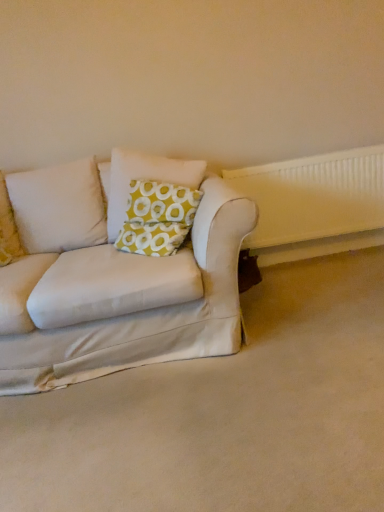
Question: Does white plastic radiator at right lie in front of white fabric couch at lower left?

Choices:
 (A) yes
 (B) no

Answer: (B)

Question: From a real-world perspective, is white plastic radiator at right under white fabric couch at lower left?

Choices:
 (A) yes
 (B) no

Answer: (B)

Question: From a real-world perspective, is white plastic radiator at right physically above white fabric couch at lower left?

Choices:
 (A) yes
 (B) no

Answer: (A)

Question: Does white plastic radiator at right lie behind white fabric couch at lower left?

Choices:
 (A) yes
 (B) no

Answer: (A)

Question: Would you consider white plastic radiator at right to be distant from white fabric couch at lower left?

Choices:
 (A) no
 (B) yes

Answer: (B)

Question: Considering the positions of point (147, 158) and point (46, 448), is point (147, 158) closer or farther from the camera than point (46, 448)?

Choices:
 (A) farther
 (B) closer

Answer: (A)

Question: Is yellow-green fabric pillow at center bigger or smaller than white fabric couch at lower left?

Choices:
 (A) big
 (B) small

Answer: (B)

Question: From a real-world perspective, relative to white fabric couch at lower left, is yellow-green fabric pillow at center vertically above or below?

Choices:
 (A) below
 (B) above

Answer: (B)

Question: In the image, is yellow-green fabric pillow at center on the left side or the right side of white fabric couch at lower left?

Choices:
 (A) right
 (B) left

Answer: (B)

Question: In the image, is white plastic radiator at right positioned in front of or behind white fabric couch at lower left?

Choices:
 (A) behind
 (B) front

Answer: (A)

Question: Looking at their shapes, would you say white plastic radiator at right is wider or thinner than white fabric couch at lower left?

Choices:
 (A) thin
 (B) wide

Answer: (A)

Question: Considering the positions of white plastic radiator at right and white fabric couch at lower left in the image, is white plastic radiator at right bigger or smaller than white fabric couch at lower left?

Choices:
 (A) big
 (B) small

Answer: (B)

Question: Is white plastic radiator at right inside the boundaries of white fabric couch at lower left, or outside?

Choices:
 (A) inside
 (B) outside

Answer: (B)

Question: Is yellow-green fabric pillow at center taller or shorter than white plastic radiator at right?

Choices:
 (A) short
 (B) tall

Answer: (A)

Question: From the image's perspective, is yellow-green fabric pillow at center located above or below white plastic radiator at right?

Choices:
 (A) below
 (B) above

Answer: (B)